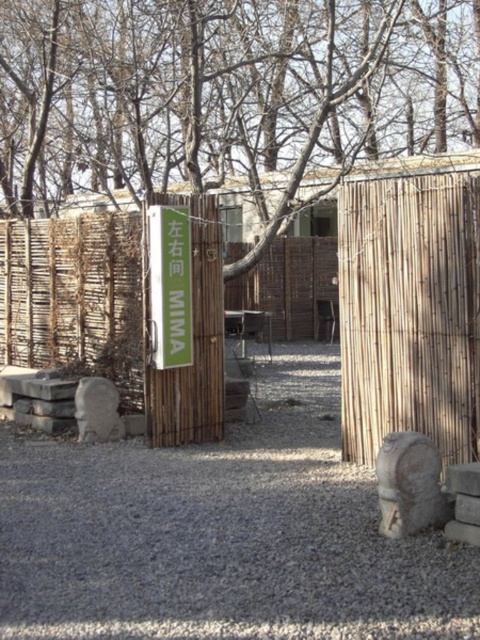
Question: Can you confirm if gray gravel at center is positioned to the left of green matte sign at center?

Choices:
 (A) yes
 (B) no

Answer: (B)

Question: Estimate the real-world distances between objects in this image. Which object is closer to the gray stone at lower right?

Choices:
 (A) green matte sign at center
 (B) gray gravel at center

Answer: (B)

Question: Which is nearer to the gray gravel at center?

Choices:
 (A) bamboo fence at center
 (B) gray stone at lower right

Answer: (B)

Question: Which of the following is the closest to the observer?

Choices:
 (A) gray stone at lower right
 (B) gray gravel at center

Answer: (A)

Question: Can you confirm if gray gravel at center is positioned to the left of gray stone at lower right?

Choices:
 (A) yes
 (B) no

Answer: (A)

Question: Does gray gravel at center appear under green matte sign at center?

Choices:
 (A) no
 (B) yes

Answer: (B)